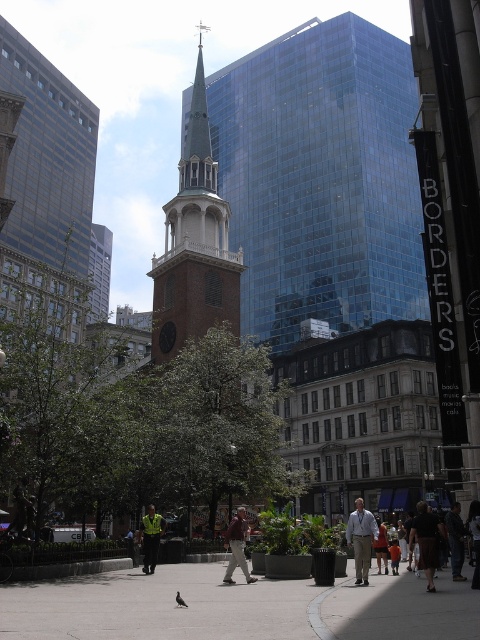
You are a pedestrian standing at the edge of the plaza. You see a brown brick steeple at center and a reflective yellow vest at center. Which object is closer to you?

The brown brick steeple at center is closer to you because the reflective yellow vest at center is behind it.

You are standing in the plaza and want to take a photo of the brown brick steeple at center. If your camera can focus on objects up to 60 meters away, will you need to move closer to get a clear shot?

The brown brick steeple at center is 62.17 meters away from the viewer. Since your camera can focus up to 60 meters, you need to move closer to ensure the steeple is within the camera range.